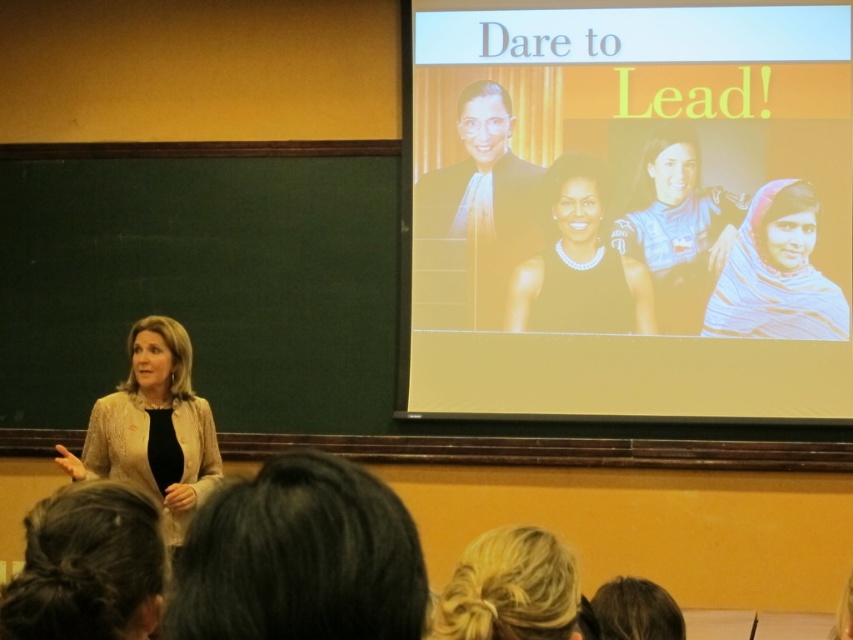
Question: Is dark brown hair at lower left positioned in front of white textured scarf at right?

Choices:
 (A) yes
 (B) no

Answer: (A)

Question: Can you confirm if matte yellow projection screen at upper center is positioned above blue fabric at center?

Choices:
 (A) no
 (B) yes

Answer: (B)

Question: Estimate the real-world distances between objects in this image. Which object is closer to the blue fabric at center?

Choices:
 (A) black satin dress at center
 (B) white textured scarf at right
 (C) dark brown hair at lower center

Answer: (A)

Question: Is matte yellow projection screen at upper center wider than matte beige blazer at left?

Choices:
 (A) yes
 (B) no

Answer: (A)

Question: Which point is closer to the camera?

Choices:
 (A) (107, 524)
 (B) (708, 298)
 (C) (634, 243)
 (D) (653, 196)

Answer: (A)

Question: Which object is the farthest from the black satin dress at center?

Choices:
 (A) matte yellow projection screen at upper center
 (B) blue fabric at center
 (C) matte beige blazer at left

Answer: (C)